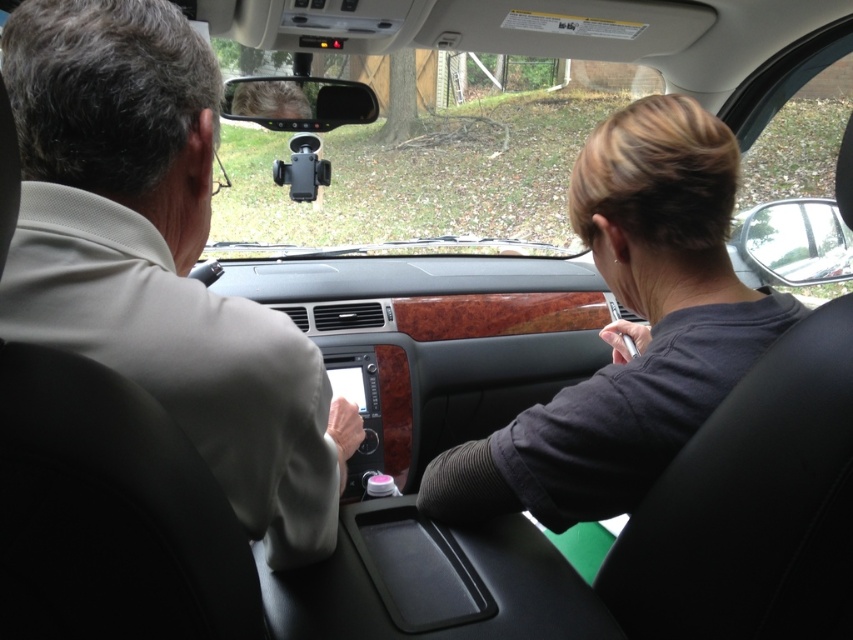
Question: Which is nearer to the light beige suit at left?

Choices:
 (A) dark gray fabric at center
 (B) clear glass side mirror at right
 (C) clear plastic view mirror at upper center

Answer: (A)

Question: Which point is closer to the camera taking this photo?

Choices:
 (A) (258, 108)
 (B) (252, 499)

Answer: (B)

Question: Which of the following is the closest to the observer?

Choices:
 (A) clear plastic view mirror at upper center
 (B) clear glass side mirror at right

Answer: (A)

Question: Is dark gray fabric at center further to the viewer compared to clear glass side mirror at right?

Choices:
 (A) no
 (B) yes

Answer: (A)

Question: Where is light beige suit at left located in relation to dark gray fabric at center in the image?

Choices:
 (A) right
 (B) left

Answer: (B)

Question: Can you confirm if dark gray fabric at center is positioned above clear glass side mirror at right?

Choices:
 (A) yes
 (B) no

Answer: (B)